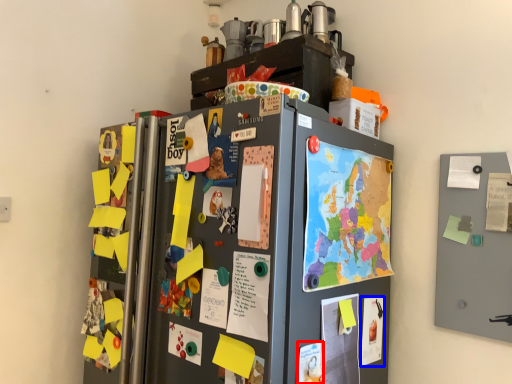
Question: Which of the following is the farthest to the observer, poster (highlighted by a red box) or poster (highlighted by a blue box)?

Choices:
 (A) poster
 (B) poster

Answer: (B)